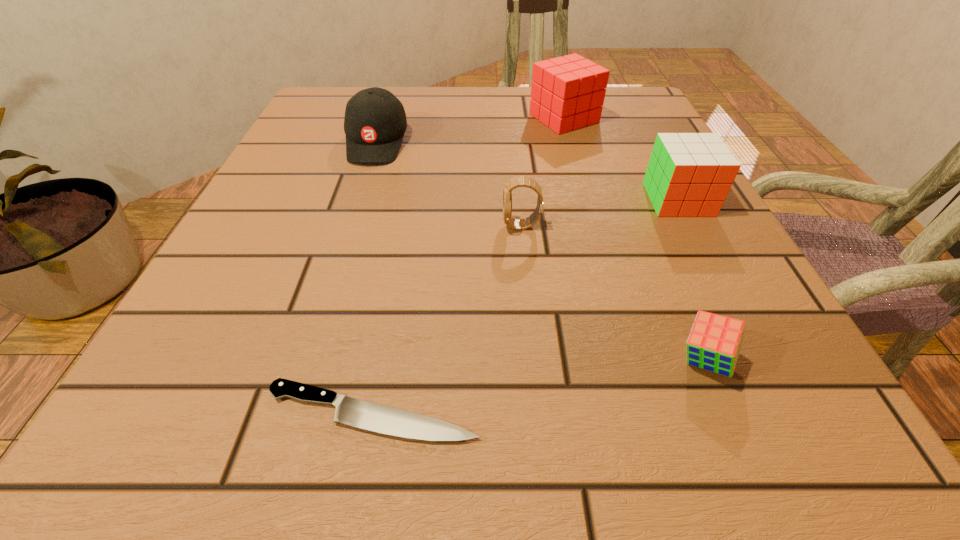
Identify the location of cube that is the third closest to the watch. (567, 93).

This screenshot has height=540, width=960. I want to click on cube identified as the closest to the second nearest cube, so click(x=567, y=93).

Where is `vacant space that satisfies the following two spatial constraints: 1. on the back side of the fifth tallest object; 2. on the face of the third object from left to right`? Image resolution: width=960 pixels, height=540 pixels. vacant space that satisfies the following two spatial constraints: 1. on the back side of the fifth tallest object; 2. on the face of the third object from left to right is located at coordinates (649, 226).

Where is `free space that satisfies the following two spatial constraints: 1. on the face of the third object from left to right; 2. on the right side of the second shortest object`? The image size is (960, 540). free space that satisfies the following two spatial constraints: 1. on the face of the third object from left to right; 2. on the right side of the second shortest object is located at coordinates (535, 360).

You are a GUI agent. You are given a task and a screenshot of the screen. Output one action in this format:
    pyautogui.click(x=<x>, y=<y>)
    Task: Click on the vacant region that satisfies the following two spatial constraints: 1. with a logo on the front of the baseball cap; 2. on the right side of the second shortest object
    
    Given the screenshot: What is the action you would take?
    pyautogui.click(x=307, y=360)